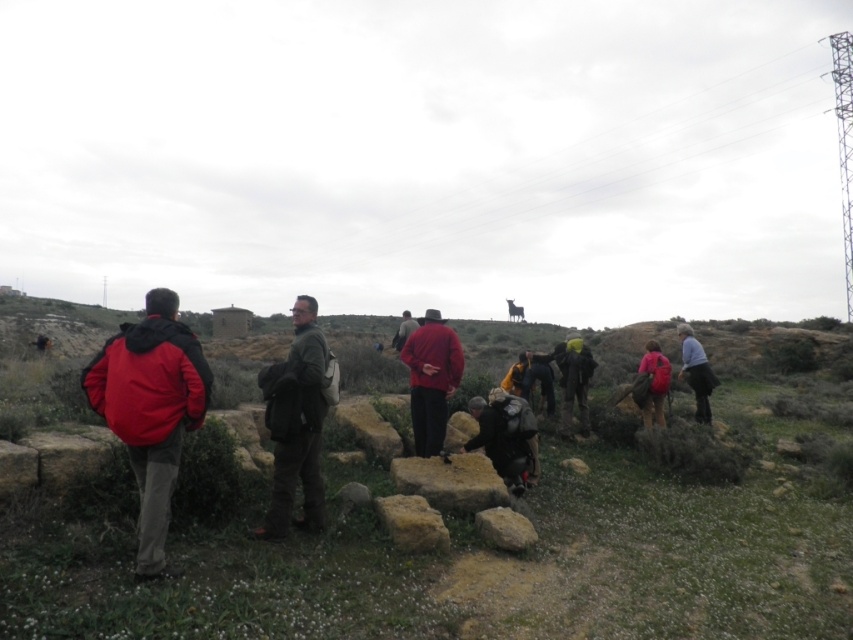
Between point (569, 170) and point (524, 476), which one is positioned behind?

The point (569, 170) is more distant.

Does metallic wire at upper center appear under dark gray backpack at center?

Incorrect, metallic wire at upper center is not positioned below dark gray backpack at center.

This screenshot has width=853, height=640. I want to click on metallic wire at upper center, so click(x=625, y=156).

Measure the distance from brown rough stone at center to orange fabric backpack at center.

brown rough stone at center is 4.89 meters away from orange fabric backpack at center.

Which is more to the right, brown rough stone at center or orange fabric backpack at center?

Positioned to the right is orange fabric backpack at center.

Does point (402, 476) come in front of point (518, 360)?

Yes, it is.

Locate an element on the screen. Image resolution: width=853 pixels, height=640 pixels. brown rough stone at center is located at coordinates (450, 481).

Can you confirm if dark gray backpack at center is positioned above orange fabric backpack at center?

Actually, dark gray backpack at center is below orange fabric backpack at center.

Measure the distance between dark gray backpack at center and camera.

dark gray backpack at center is 7.53 meters away from camera.

Where is `dark gray backpack at center`? This screenshot has height=640, width=853. dark gray backpack at center is located at coordinates (505, 436).